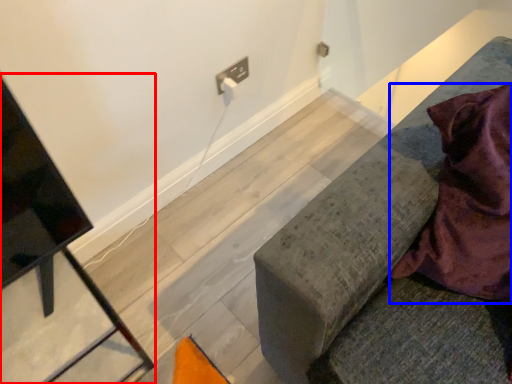
Question: Which of the following is the farthest to the observer, furniture (highlighted by a red box) or blanket (highlighted by a blue box)?

Choices:
 (A) furniture
 (B) blanket

Answer: (A)